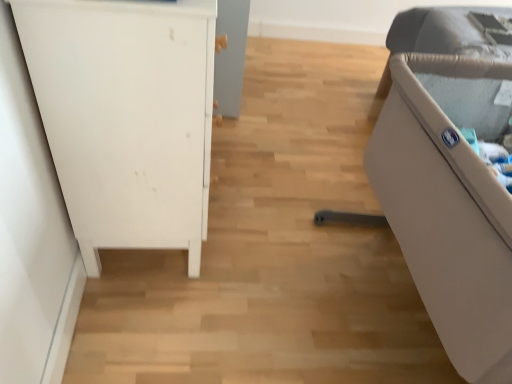
Question: In terms of height, does beige plastic crib at right, the second furniture from the left, look taller or shorter compared to white matte cabinet at left, which is the second furniture in right-to-left order?

Choices:
 (A) short
 (B) tall

Answer: (A)

Question: Is beige plastic crib at right, the second furniture from the left, wider or thinner than white matte cabinet at left, which is the second furniture in right-to-left order?

Choices:
 (A) wide
 (B) thin

Answer: (A)

Question: Based on their positions, is beige plastic crib at right, the second furniture from the left, located to the left or right of white matte cabinet at left, which is the second furniture in right-to-left order?

Choices:
 (A) left
 (B) right

Answer: (B)

Question: Is white matte cabinet at left, positioned as the 1th furniture in left-to-right order, inside the boundaries of beige plastic crib at right, the second furniture from the left, or outside?

Choices:
 (A) outside
 (B) inside

Answer: (A)

Question: Does point (79, 145) appear closer or farther from the camera than point (446, 329)?

Choices:
 (A) farther
 (B) closer

Answer: (A)

Question: Would you say white matte cabinet at left, positioned as the 1th furniture in left-to-right order, is to the left or to the right of beige plastic crib at right, the 1th furniture when ordered from right to left, in the picture?

Choices:
 (A) right
 (B) left

Answer: (B)

Question: Is white matte cabinet at left, positioned as the 1th furniture in left-to-right order, bigger or smaller than beige plastic crib at right, the second furniture from the left?

Choices:
 (A) small
 (B) big

Answer: (A)